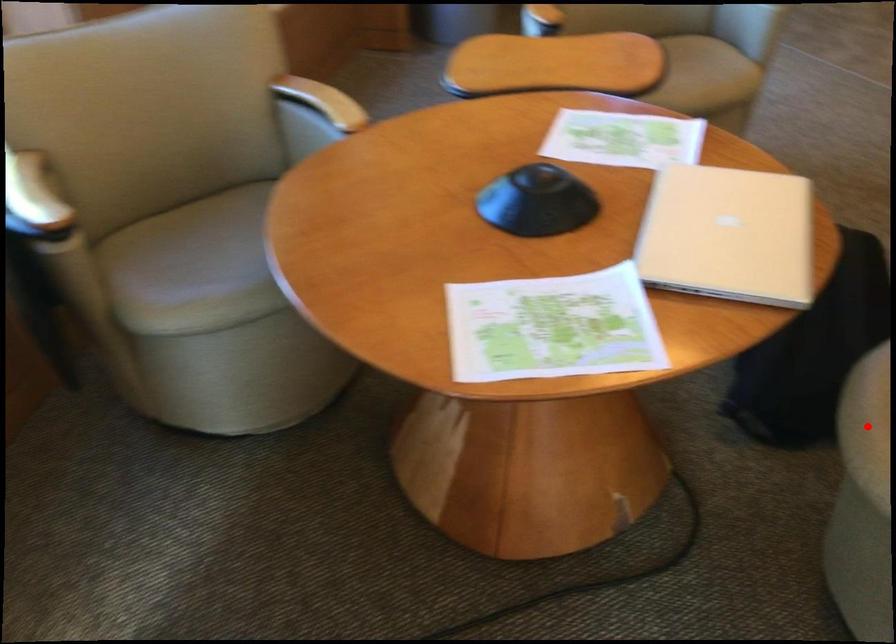
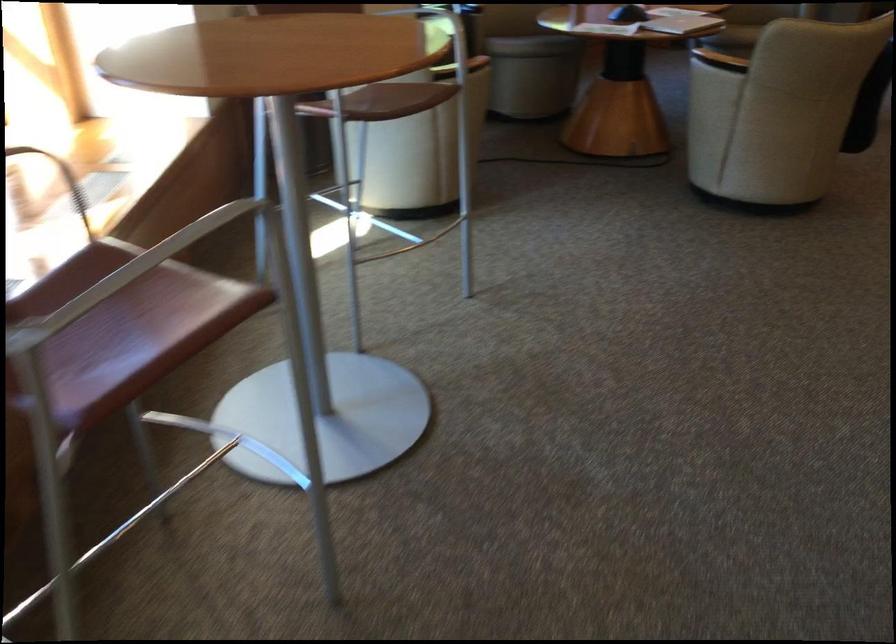
Question: I am providing you with two images of the same scene from different viewpoints. A red point is marked on the first image. Is the red point's position out of view in image 2?

Choices:
 (A) Yes
 (B) No

Answer: (A)